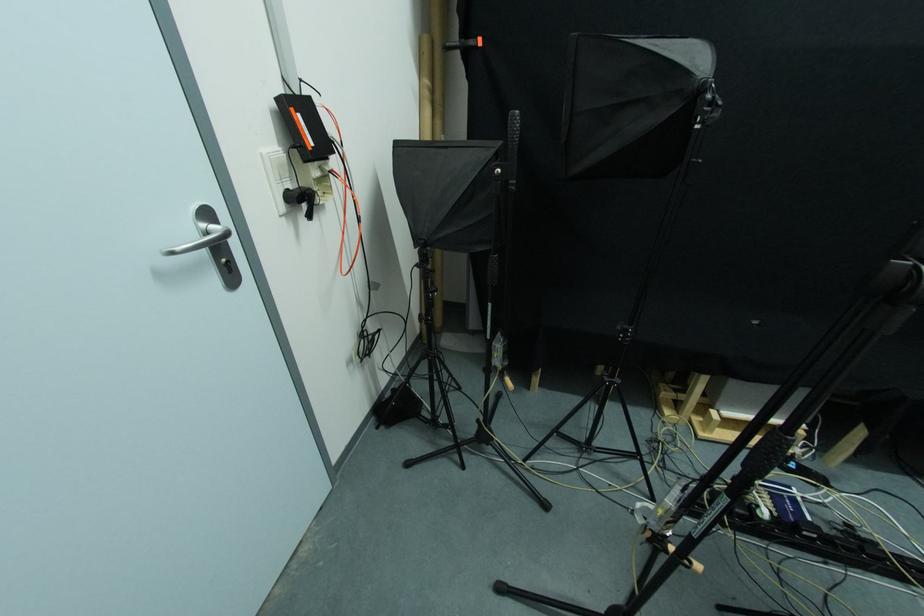
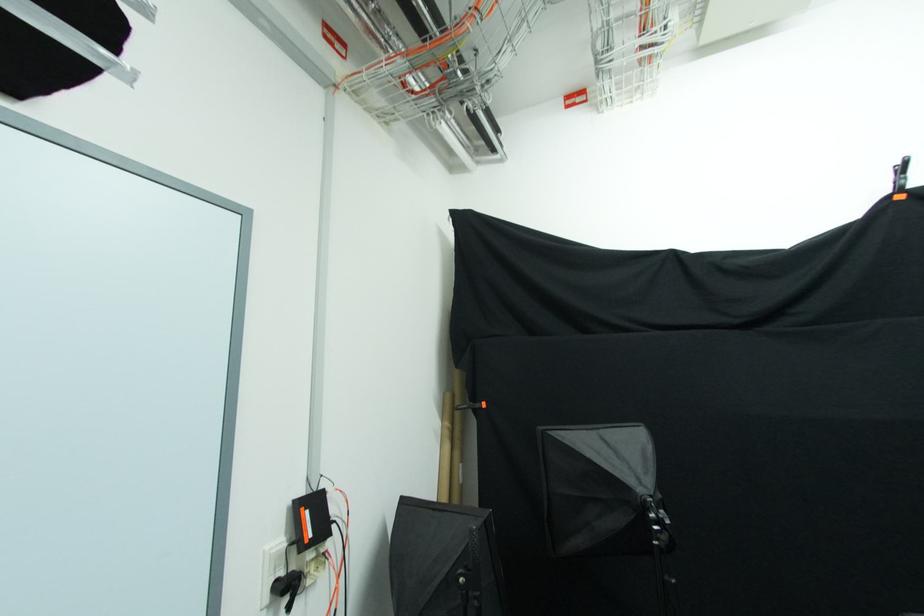
Question: I am providing you with two images of the same scene from different viewpoints. Which of the following objects are not visible in image2?

Choices:
 (A) cardboard tube
 (B) white light switch
 (C) black power plug
 (D) none of these

Answer: (D)